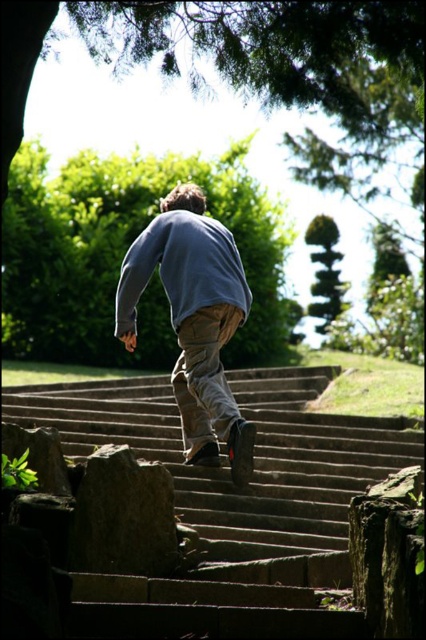
Is stone stairs at center thinner than gray rough stone at lower left?

No, stone stairs at center is not thinner than gray rough stone at lower left.

The image size is (426, 640). What are the coordinates of `stone stairs at center` in the screenshot? It's located at (232, 502).

Does stone stairs at center appear over light blue cotton shirt at center?

Yes, stone stairs at center is above light blue cotton shirt at center.

Can you confirm if stone stairs at center is smaller than light blue cotton shirt at center?

No, stone stairs at center is not smaller than light blue cotton shirt at center.

Measure the distance between stone stairs at center and camera.

stone stairs at center and camera are 24.81 feet apart.

In order to click on stone stairs at center in this screenshot , I will do `click(232, 502)`.

Is light blue cotton shirt at center to the left of gray rough stone at lower left from the viewer's perspective?

Incorrect, light blue cotton shirt at center is not on the left side of gray rough stone at lower left.

Who is more forward, (x=132, y=246) or (x=135, y=556)?

Point (x=135, y=556)

Who is more forward, (x=189, y=273) or (x=147, y=518)?

Point (x=147, y=518) is more forward.

The height and width of the screenshot is (640, 426). Find the location of `light blue cotton shirt at center`. light blue cotton shirt at center is located at coordinates (193, 321).